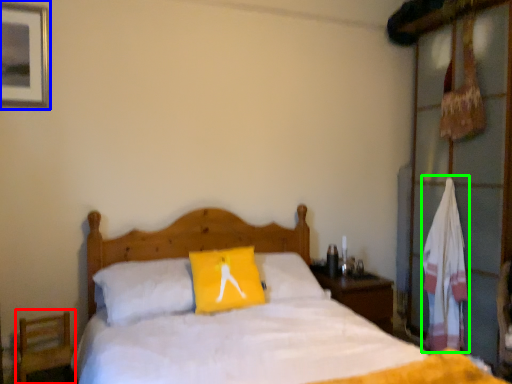
Question: Which object is positioned farthest from armchair (highlighted by a red box)? Select from picture frame (highlighted by a blue box) and material (highlighted by a green box).

Choices:
 (A) picture frame
 (B) material

Answer: (B)